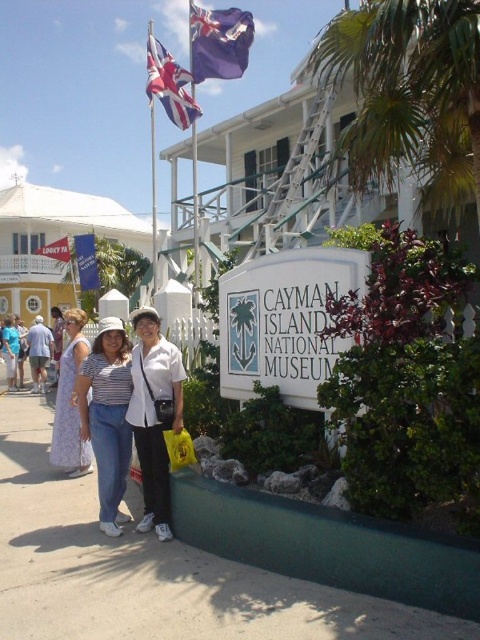
Question: Does green leafy palm tree at upper right appear on the right side of printed cotton dress at lower left?

Choices:
 (A) yes
 (B) no

Answer: (A)

Question: Does white tent at left appear on the right side of yellow plastic bag at lower center?

Choices:
 (A) no
 (B) yes

Answer: (A)

Question: Can you confirm if white tent at left is positioned to the right of union jack flag at upper left?

Choices:
 (A) no
 (B) yes

Answer: (A)

Question: Which object is the closest to the white plastic sign at center?

Choices:
 (A) gray concrete pavement at lower center
 (B) purple fabric flag at upper center
 (C) yellow plastic bag at lower center

Answer: (C)

Question: Which of these objects is positioned farthest from the white tent at left?

Choices:
 (A) yellow plastic bag at lower center
 (B) striped cotton shirt at center

Answer: (A)

Question: Which point is farther to the camera?

Choices:
 (A) pyautogui.click(x=252, y=17)
 (B) pyautogui.click(x=124, y=422)
 (C) pyautogui.click(x=95, y=246)

Answer: (C)